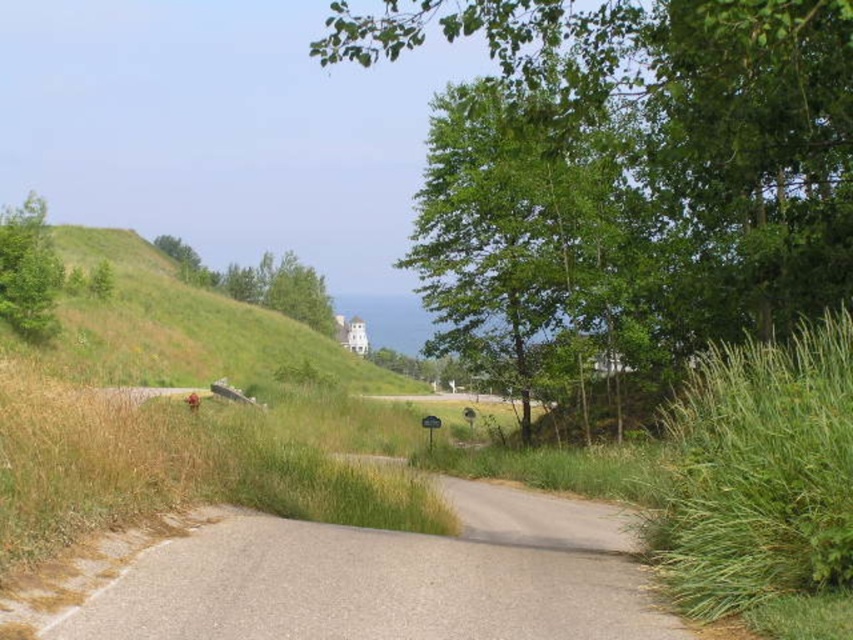
Can you confirm if green leafy tree at left is positioned to the left of green leafy tree at upper left?

Yes, green leafy tree at left is to the left of green leafy tree at upper left.

What do you see at coordinates (28, 272) in the screenshot? I see `green leafy tree at left` at bounding box center [28, 272].

Which is in front, point (16, 276) or point (260, 288)?

Point (16, 276) is in front.

The width and height of the screenshot is (853, 640). I want to click on green leafy tree at left, so click(28, 272).

Can you confirm if gray asphalt path at center is smaller than green leafy tree at center?

Correct, gray asphalt path at center occupies less space than green leafy tree at center.

Who is taller, gray asphalt path at center or green leafy tree at center?

green leafy tree at center

This screenshot has height=640, width=853. Find the location of `gray asphalt path at center`. gray asphalt path at center is located at coordinates (387, 579).

Who is lower down, green leafy tree at upper center or green leafy tree at upper left?

green leafy tree at upper left

Can you confirm if green leafy tree at upper center is taller than green leafy tree at upper left?

Yes.

This screenshot has height=640, width=853. I want to click on green leafy tree at upper center, so click(x=624, y=172).

Find the location of a particular element. green leafy tree at upper center is located at coordinates (624, 172).